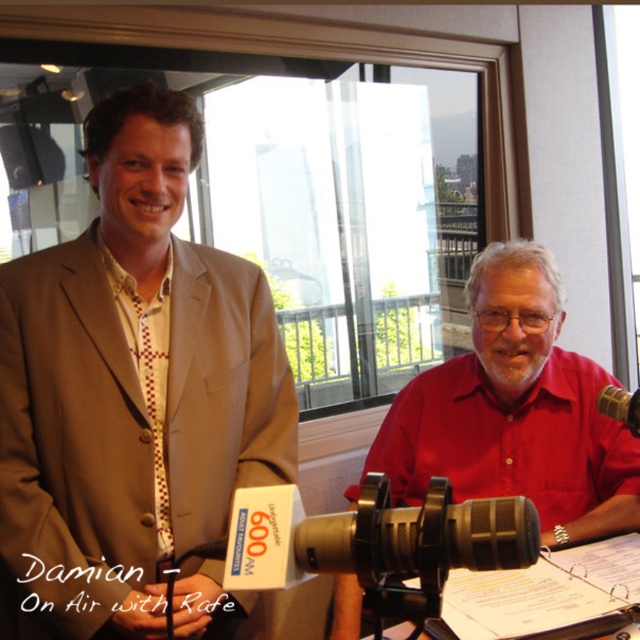
The height and width of the screenshot is (640, 640). I want to click on matte beige suit at center, so click(x=129, y=388).

Which of these two, matte beige suit at center or black matte microphone at lower center, stands shorter?

With less height is black matte microphone at lower center.

Is point (156, 488) more distant than point (532, 561)?

Yes, it is.

I want to click on matte beige suit at center, so click(x=129, y=388).

Is matte beige suit at center bigger than black plastic microphone at lower center?

Indeed, matte beige suit at center has a larger size compared to black plastic microphone at lower center.

Does point (172, 413) come in front of point (468, 595)?

Yes, it is.

The height and width of the screenshot is (640, 640). What are the coordinates of `matte beige suit at center` in the screenshot? It's located at (129, 388).

Who is more distant from viewer, (93,280) or (614,458)?

Point (614,458)

Who is higher up, matte beige suit at center or red matte shirt at center?

Positioned higher is matte beige suit at center.

Does point (144, 300) lie behind point (419, 474)?

That is False.

This screenshot has width=640, height=640. In order to click on matte beige suit at center in this screenshot , I will do `click(129, 388)`.